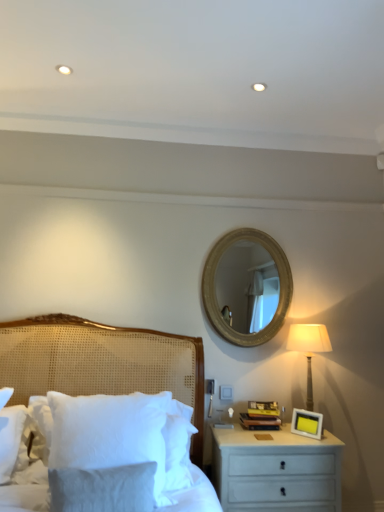
Image resolution: width=384 pixels, height=512 pixels. What do you see at coordinates (276, 470) in the screenshot?
I see `white painted wood nightstand at lower right` at bounding box center [276, 470].

At what (x,y) coordinates should I click in order to perform the action: click on white painted wood nightstand at lower right. Please return your answer as a coordinate pair (x, y). Looking at the image, I should click on (276, 470).

In order to face gold textured mirror at upper center, should I rotate leftwards or rightwards?

A 7.979 degree turn to the right will do.

The height and width of the screenshot is (512, 384). What do you see at coordinates (101, 362) in the screenshot? I see `white woven bed at left` at bounding box center [101, 362].

Describe the element at coordinates (110, 433) in the screenshot. I see `white fluffy pillow at lower left` at that location.

The height and width of the screenshot is (512, 384). I want to click on matte beige lamp at right, so click(x=308, y=348).

At what (x,y) coordinates should I click in order to perform the action: click on white painted wood nightstand at lower right. Please return your answer as a coordinate pair (x, y). Looking at the image, I should click on (276, 470).

Who is shorter, yellow matte picture frame at right or white painted wood nightstand at lower right?

yellow matte picture frame at right.

Looking at this image, is yellow matte picture frame at right beside white painted wood nightstand at lower right?

No, yellow matte picture frame at right is not with white painted wood nightstand at lower right.

Does yellow matte picture frame at right turn towards white painted wood nightstand at lower right?

No, yellow matte picture frame at right is not oriented towards white painted wood nightstand at lower right.

Is yellow matte picture frame at right to the right of white painted wood nightstand at lower right from the viewer's perspective?

Yes, yellow matte picture frame at right is to the right of white painted wood nightstand at lower right.

Is point (300, 438) positioned after point (159, 395)?

Yes, it is.

Looking at this image, does white painted wood nightstand at lower right have a greater height compared to white fluffy pillow at lower left?

Indeed, white painted wood nightstand at lower right has a greater height compared to white fluffy pillow at lower left.

Is white painted wood nightstand at lower right to the left or to the right of white fluffy pillow at lower left in the image?

white painted wood nightstand at lower right is to the right of white fluffy pillow at lower left.

Is white fluffy pillow at lower left at the back of white painted wood nightstand at lower right?

No, white painted wood nightstand at lower right is not facing away from white fluffy pillow at lower left.

Is gold textured mirror at upper center not inside yellow matte picture frame at right?

Indeed, gold textured mirror at upper center is completely outside yellow matte picture frame at right.

Which object is positioned more to the left, gold textured mirror at upper center or yellow matte picture frame at right?

From the viewer's perspective, gold textured mirror at upper center appears more on the left side.

Is yellow matte picture frame at right at the back of gold textured mirror at upper center?

That's not correct — gold textured mirror at upper center is not looking away from yellow matte picture frame at right.

From a real-world perspective, is white painted wood nightstand at lower right physically below gold textured mirror at upper center?

Yes.

Can you confirm if white painted wood nightstand at lower right is positioned to the right of gold textured mirror at upper center?

Correct, you'll find white painted wood nightstand at lower right to the right of gold textured mirror at upper center.

Which point is more forward, (x=320, y=457) or (x=232, y=286)?

The point (x=320, y=457) is in front.

Based on the photo, is the position of gold textured mirror at upper center more distant than that of white fluffy pillow at lower left?

That is True.

Looking at this image, considering the sizes of objects gold textured mirror at upper center and white fluffy pillow at lower left in the image provided, who is smaller, gold textured mirror at upper center or white fluffy pillow at lower left?

With smaller size is white fluffy pillow at lower left.

Who is taller, gold textured mirror at upper center or white fluffy pillow at lower left?

With more height is gold textured mirror at upper center.

Which is nearer, (217, 275) or (155, 420)?

Point (217, 275) appears to be farther away from the viewer than point (155, 420).

Can you confirm if white woven bed at left is shorter than matte beige lamp at right?

No.

Could you tell me if white woven bed at left is facing matte beige lamp at right?

No.

From a real-world perspective, is white woven bed at left physically located above or below matte beige lamp at right?

white woven bed at left is below matte beige lamp at right.

Based on their sizes in the image, would you say white fluffy pillow at lower left is bigger or smaller than white woven bed at left?

Clearly, white fluffy pillow at lower left is smaller in size than white woven bed at left.

Considering the relative sizes of white fluffy pillow at lower left and white woven bed at left in the image provided, is white fluffy pillow at lower left thinner than white woven bed at left?

Correct, the width of white fluffy pillow at lower left is less than that of white woven bed at left.

Considering the relative sizes of white fluffy pillow at lower left and white woven bed at left in the image provided, is white fluffy pillow at lower left taller than white woven bed at left?

No, white fluffy pillow at lower left is not taller than white woven bed at left.

Is white fluffy pillow at lower left next to white woven bed at left?

No, white fluffy pillow at lower left is not touching white woven bed at left.

Locate an element on the screen. picture frame behind the white painted wood nightstand at lower right is located at coordinates (307, 423).

Locate an element on the screen. This screenshot has width=384, height=512. pillow located on the left of white painted wood nightstand at lower right is located at coordinates (110, 433).

Estimate the real-world distances between objects in this image. Which object is further from white fluffy pillow at lower left, white woven bed at left or matte beige lamp at right?

Among the two, matte beige lamp at right is located further to white fluffy pillow at lower left.

From the image, which object appears to be farther from white woven bed at left, white painted wood nightstand at lower right or gold textured mirror at upper center?

Based on the image, gold textured mirror at upper center appears to be further to white woven bed at left.

Looking at the image, which one is located further to matte beige lamp at right, white painted wood nightstand at lower right or yellow matte picture frame at right?

white painted wood nightstand at lower right lies further to matte beige lamp at right than the other object.

Looking at the image, which one is located further to matte beige lamp at right, gold textured mirror at upper center or white painted wood nightstand at lower right?

Among the two, gold textured mirror at upper center is located further to matte beige lamp at right.

Considering their positions, is matte beige lamp at right positioned closer to white fluffy pillow at lower left than yellow matte picture frame at right?

yellow matte picture frame at right.

Which object lies nearer to the anchor point gold textured mirror at upper center, yellow matte picture frame at right or white woven bed at left?

The object closer to gold textured mirror at upper center is yellow matte picture frame at right.

When comparing their distances from yellow matte picture frame at right, does white woven bed at left or white fluffy pillow at lower left seem further?

white fluffy pillow at lower left.

Considering their positions, is white woven bed at left positioned closer to gold textured mirror at upper center than matte beige lamp at right?

matte beige lamp at right.

The height and width of the screenshot is (512, 384). Identify the location of picture frame between gold textured mirror at upper center and white painted wood nightstand at lower right from top to bottom. (307, 423).

The width and height of the screenshot is (384, 512). I want to click on pillow located between white woven bed at left and white painted wood nightstand at lower right in the left-right direction, so click(x=110, y=433).

You are a GUI agent. You are given a task and a screenshot of the screen. Output one action in this format:
    pyautogui.click(x=<x>, y=<y>)
    Task: Click on the mirror located between white woven bed at left and matte beige lamp at right in the left-right direction
    Image resolution: width=384 pixels, height=512 pixels.
    Given the screenshot: What is the action you would take?
    [x=247, y=285]

You are a GUI agent. You are given a task and a screenshot of the screen. Output one action in this format:
    pyautogui.click(x=<x>, y=<y>)
    Task: Click on the picture frame between white fluffy pillow at lower left and matte beige lamp at right from left to right
    The width and height of the screenshot is (384, 512).
    Given the screenshot: What is the action you would take?
    pyautogui.click(x=307, y=423)